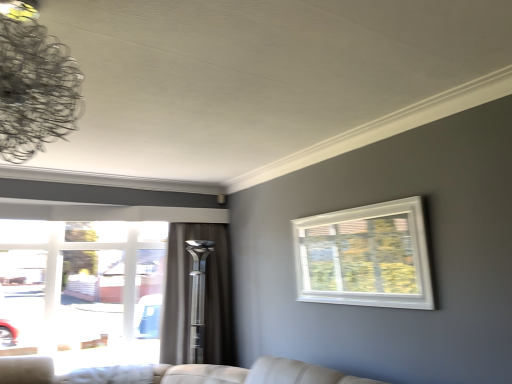
Question: Does metallic wire chandelier at upper left come in front of silky gray curtain at center?

Choices:
 (A) yes
 (B) no

Answer: (A)

Question: Is metallic wire chandelier at upper left shorter than silky gray curtain at center?

Choices:
 (A) no
 (B) yes

Answer: (B)

Question: Is metallic wire chandelier at upper left taller than silky gray curtain at center?

Choices:
 (A) yes
 (B) no

Answer: (B)

Question: Is metallic wire chandelier at upper left thinner than silky gray curtain at center?

Choices:
 (A) yes
 (B) no

Answer: (B)

Question: Would you consider metallic wire chandelier at upper left to be distant from silky gray curtain at center?

Choices:
 (A) yes
 (B) no

Answer: (A)

Question: Is metallic wire chandelier at upper left inside or outside of white plastic window at upper right, positioned as the second window in left-to-right order?

Choices:
 (A) outside
 (B) inside

Answer: (A)

Question: Is metallic wire chandelier at upper left wider or thinner than white plastic window at upper right, the 1th window viewed from the right?

Choices:
 (A) wide
 (B) thin

Answer: (A)

Question: Is metallic wire chandelier at upper left bigger or smaller than white plastic window at upper right, positioned as the second window in left-to-right order?

Choices:
 (A) big
 (B) small

Answer: (A)

Question: Does point (44, 114) appear closer or farther from the camera than point (353, 254)?

Choices:
 (A) farther
 (B) closer

Answer: (B)

Question: Considering their positions, is metallic wire chandelier at upper left located in front of or behind clear glass window at left, the first window when ordered from left to right?

Choices:
 (A) behind
 (B) front

Answer: (B)

Question: Is point click(61, 76) positioned closer to the camera than point click(22, 233)?

Choices:
 (A) closer
 (B) farther

Answer: (A)

Question: From a real-world perspective, relative to clear glass window at left, arranged as the 2th window when viewed from the front, is metallic wire chandelier at upper left vertically above or below?

Choices:
 (A) above
 (B) below

Answer: (A)

Question: Considering the positions of metallic wire chandelier at upper left and clear glass window at left, arranged as the 2th window when viewed from the front, in the image, is metallic wire chandelier at upper left wider or thinner than clear glass window at left, arranged as the 2th window when viewed from the front,?

Choices:
 (A) thin
 (B) wide

Answer: (A)

Question: Would you say silky gray curtain at center is to the left or to the right of metallic wire chandelier at upper left in the picture?

Choices:
 (A) left
 (B) right

Answer: (B)

Question: Is silky gray curtain at center situated inside metallic wire chandelier at upper left or outside?

Choices:
 (A) inside
 (B) outside

Answer: (B)